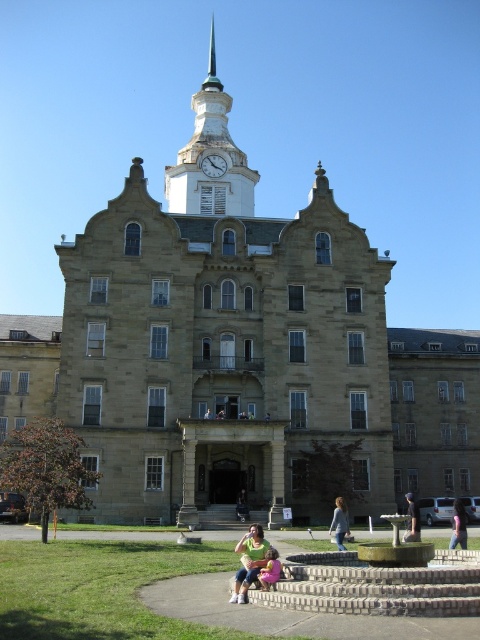
Question: Which point is closer to the camera taking this photo?

Choices:
 (A) (216, 172)
 (B) (340, 529)
 (C) (411, 531)

Answer: (C)

Question: Is stone clock tower at center behind dark blue jeans at center?

Choices:
 (A) no
 (B) yes

Answer: (A)

Question: Which of the following is the farthest from the observer?

Choices:
 (A) pink fabric at lower center
 (B) white painted wood clock tower at upper center
 (C) denim jacket at lower center
 (D) matte green shirt at center

Answer: (B)

Question: Estimate the real-world distances between objects in this image. Which object is farther from the pink fabric at lower center?

Choices:
 (A) white glossy clock at upper center
 (B) dark blue jeans at lower center
 (C) matte green shirt at center

Answer: (A)

Question: Is the position of white painted wood clock tower at upper center more distant than that of denim jacket at lower center?

Choices:
 (A) yes
 (B) no

Answer: (A)

Question: Is the position of white painted wood clock tower at upper center less distant than that of dark blue jeans at center?

Choices:
 (A) yes
 (B) no

Answer: (B)